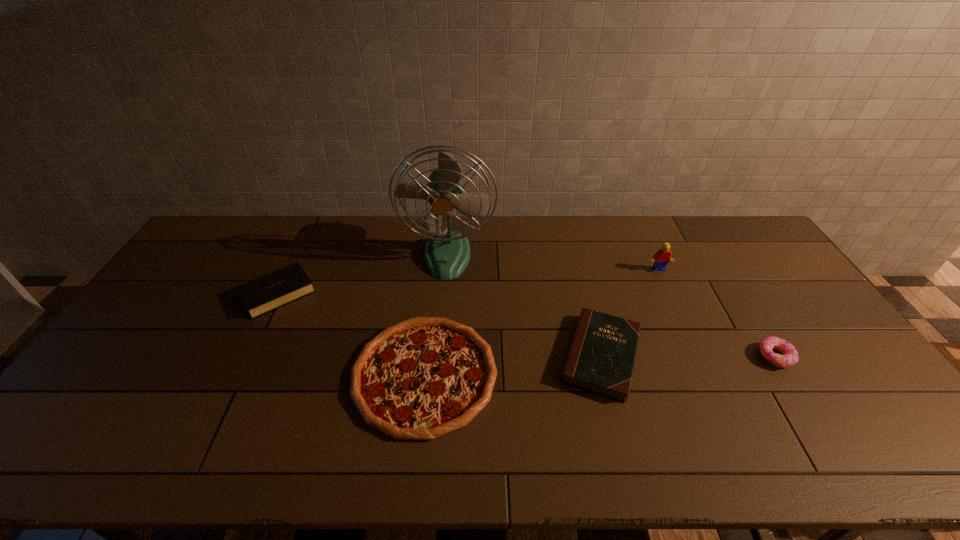
The height and width of the screenshot is (540, 960). Find the location of `empty space that is in between the tallest object and the Lego`. empty space that is in between the tallest object and the Lego is located at coordinates (553, 262).

The image size is (960, 540). Find the location of `free spot between the fan and the rightmost object`. free spot between the fan and the rightmost object is located at coordinates (612, 306).

Find the location of a particular element. empty location between the leftmost object and the shortest object is located at coordinates (348, 334).

Where is `vacant area that lies between the right Bible and the second tallest object`? Image resolution: width=960 pixels, height=540 pixels. vacant area that lies between the right Bible and the second tallest object is located at coordinates (630, 313).

The height and width of the screenshot is (540, 960). Identify the location of vacant point located between the fourth object from left to right and the doughnut. (688, 356).

At what (x,y) coordinates should I click in order to perform the action: click on vacant point located between the left Bible and the tallest object. Please return your answer as a coordinate pair (x, y). Looking at the image, I should click on (360, 274).

The image size is (960, 540). I want to click on empty space that is in between the third object from right to left and the rightmost object, so click(688, 356).

Locate an element on the screen. The height and width of the screenshot is (540, 960). free space that is in between the fifth shortest object and the fourth object from left to right is located at coordinates (630, 313).

This screenshot has width=960, height=540. Identify the location of free spot between the pizza and the fifth shortest object. (540, 322).

Identify which object is located as the second nearest to the pizza. Please provide its 2D coordinates. Your answer should be formatted as a tuple, i.e. [(x, y)], where the tuple contains the x and y coordinates of a point satisfying the conditions above.

[(271, 291)]